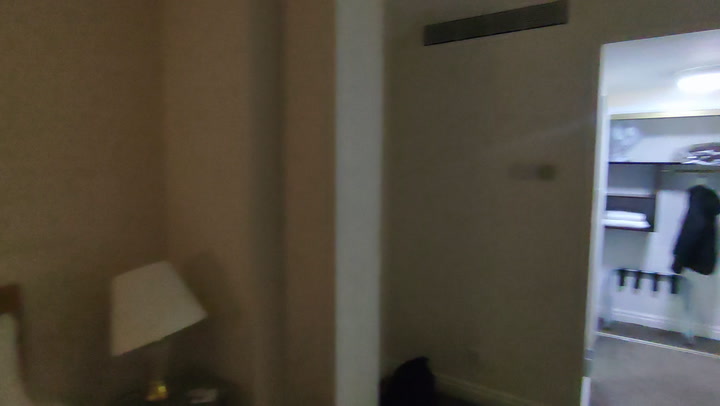
Where is `gray carpeting`? Image resolution: width=720 pixels, height=406 pixels. gray carpeting is located at coordinates (x=669, y=372).